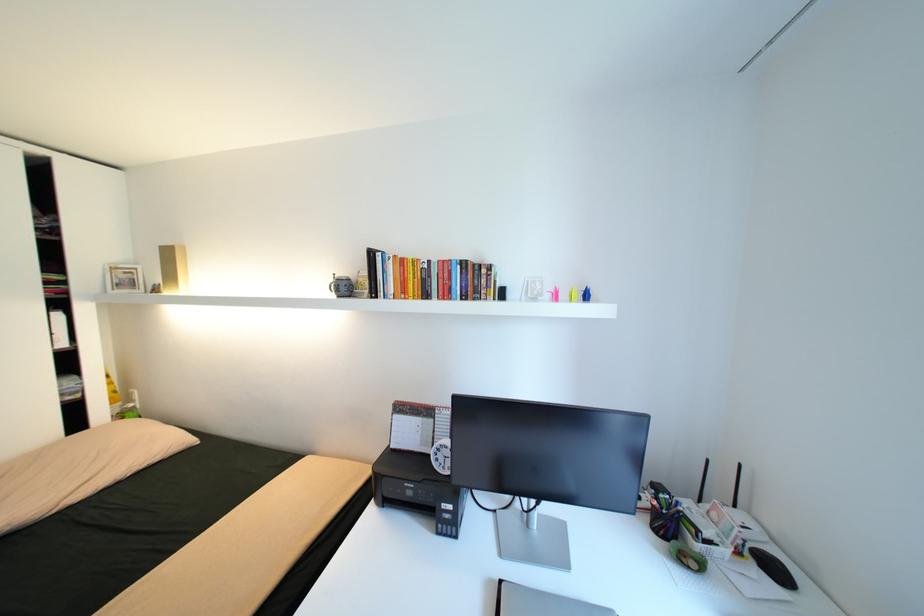
The height and width of the screenshot is (616, 924). In order to click on gold table lamp in this screenshot , I will do `click(174, 268)`.